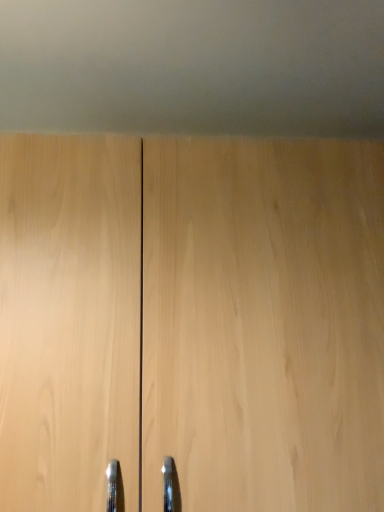
Image resolution: width=384 pixels, height=512 pixels. I want to click on light wood door at center, so click(192, 322).

What do you see at coordinates (192, 322) in the screenshot? The width and height of the screenshot is (384, 512). I see `light wood door at center` at bounding box center [192, 322].

You are a GUI agent. You are given a task and a screenshot of the screen. Output one action in this format:
    pyautogui.click(x=<x>, y=<y>)
    Task: Click on the light wood door at center
    The image size is (384, 512).
    Given the screenshot: What is the action you would take?
    (192, 322)